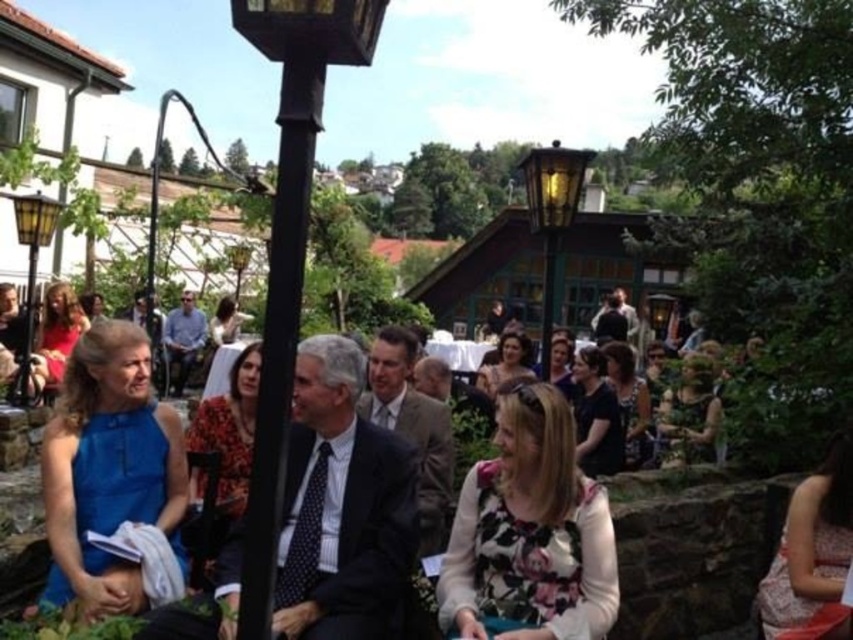
Question: Can you confirm if blue satin dress at left is positioned to the left of matte yellow lamp post at left?

Choices:
 (A) no
 (B) yes

Answer: (A)

Question: Which object appears closest to the camera in this image?

Choices:
 (A) blue satin dress at left
 (B) matte yellow lamp post at left
 (C) matte black lamp post at center
 (D) black metal lamp post at center

Answer: (D)

Question: Which object appears closest to the camera in this image?

Choices:
 (A) matte yellow lamp post at left
 (B) black metal lamp post at center

Answer: (B)

Question: Which is farther from the matte yellow lamp post at left?

Choices:
 (A) matte black lamp post at center
 (B) black metal lamp post at center
 (C) floral fabric dress at center

Answer: (A)

Question: Does blue satin dress at left appear over matte black lamp post at center?

Choices:
 (A) no
 (B) yes

Answer: (A)

Question: Can you confirm if floral fabric dress at center is wider than black metal lamp post at center?

Choices:
 (A) no
 (B) yes

Answer: (A)